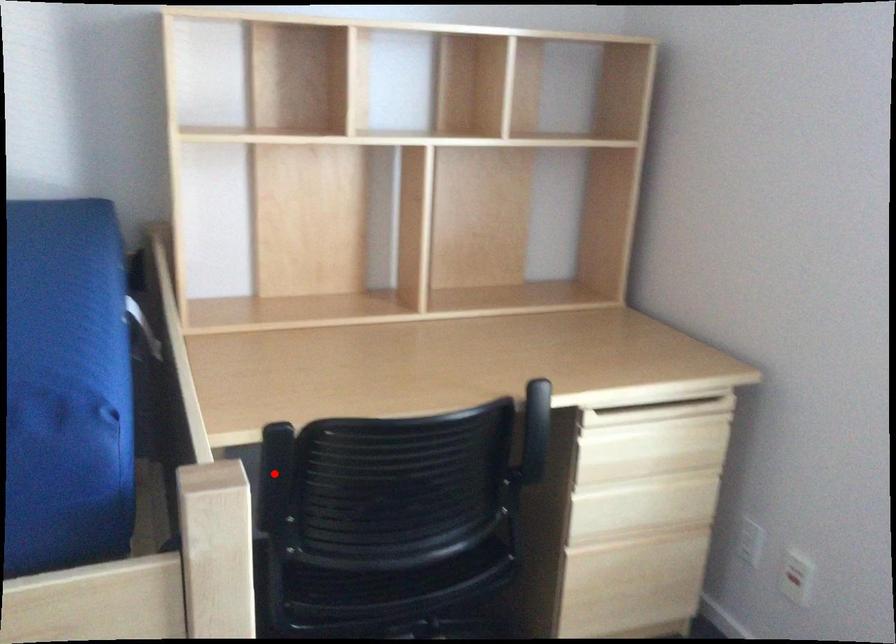
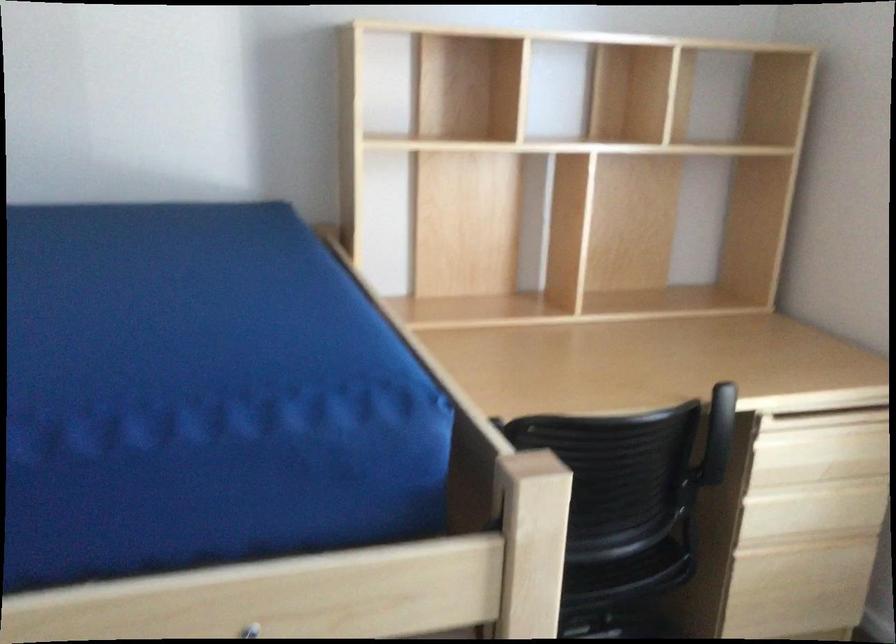
Question: I am providing you with two images of the same scene from different viewpoints. A red point is marked on the first image. At the location where the point appears in image 1, is it still visible in image 2?

Choices:
 (A) Yes
 (B) No

Answer: (B)